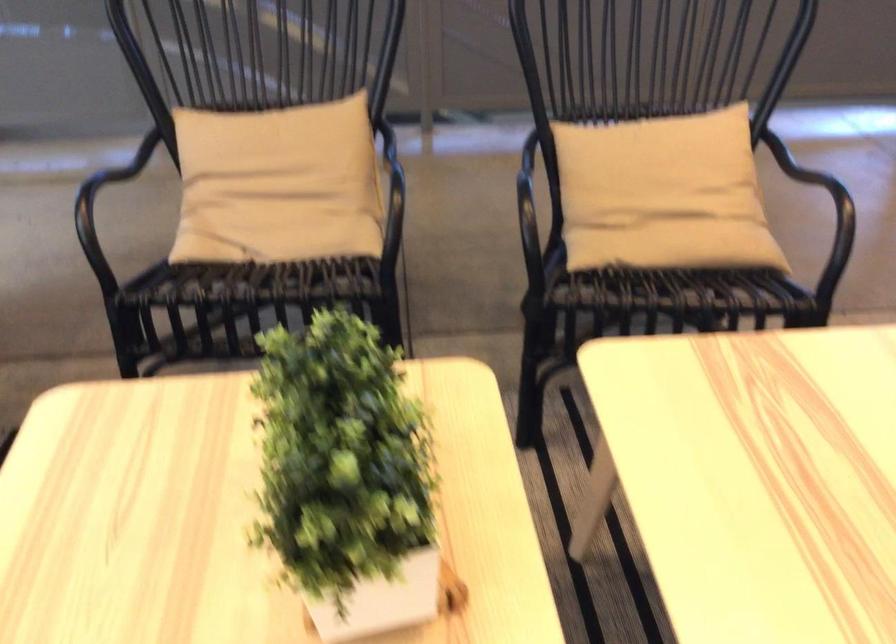
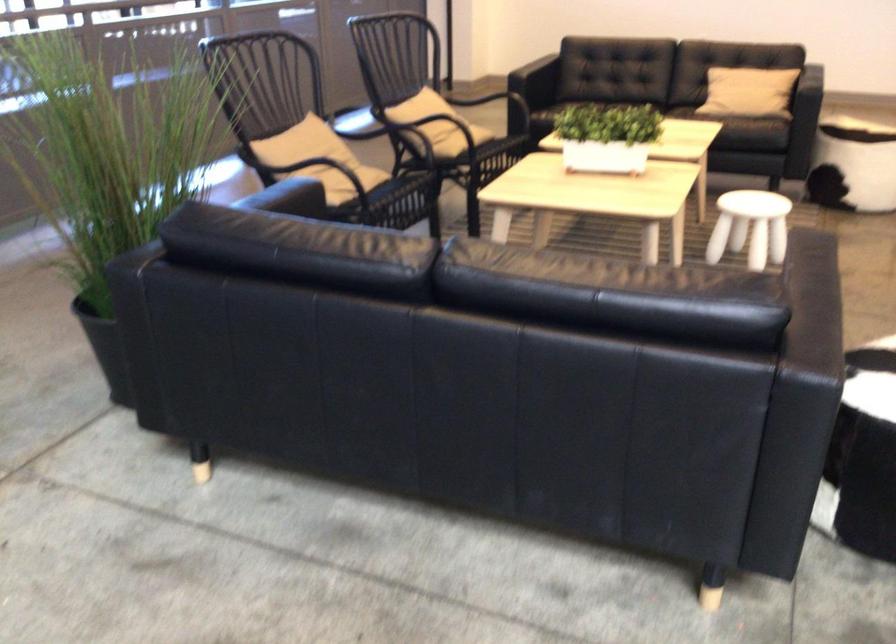
Question: I am providing you with two images of the same scene from different viewpoints. Which of the following objects are not visible in image2?

Choices:
 (A) white rectangular planter
 (B) patterned cylindrical ottoman
 (C) black sofa armrest
 (D) none of these

Answer: (D)